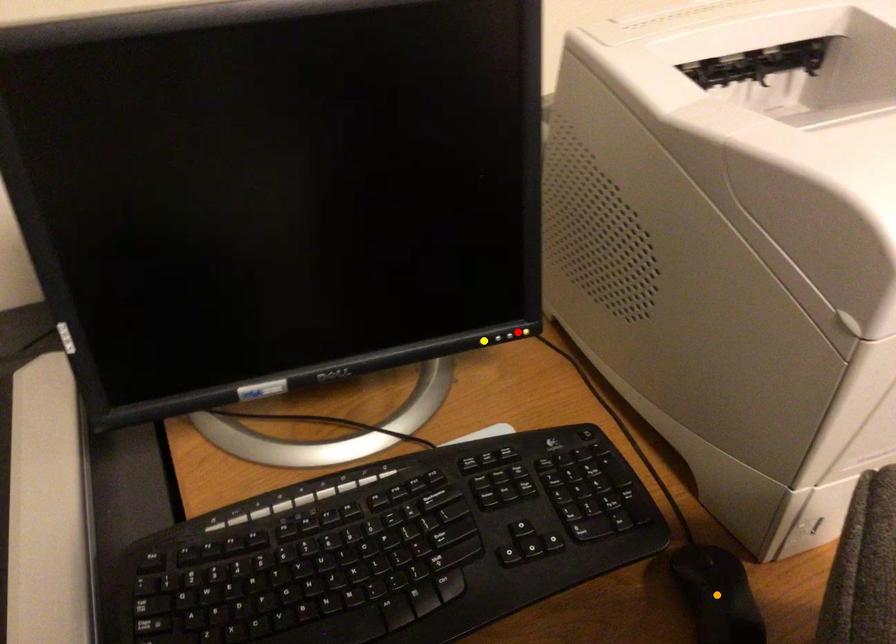
Order these from nearest to farthest:
- yellow point
- red point
- orange point

red point, yellow point, orange point